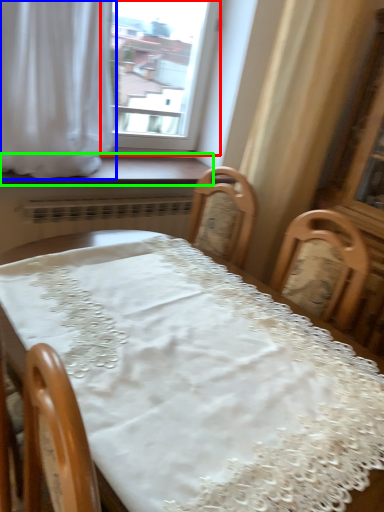
Question: Estimate the real-world distances between objects in this image. Which object is closer to window (highlighted by a red box), curtain (highlighted by a blue box) or window sill (highlighted by a green box)?

Choices:
 (A) curtain
 (B) window sill

Answer: (B)